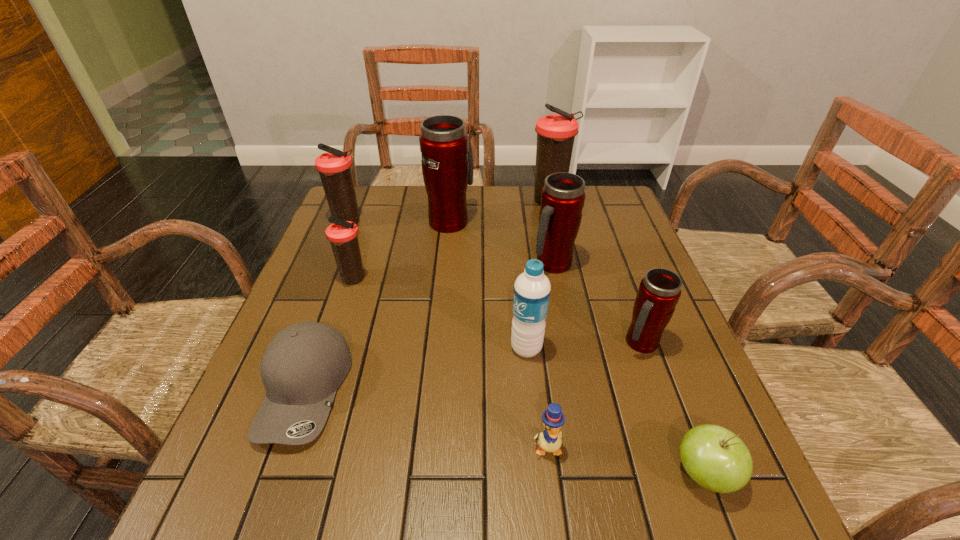
Locate an element on the screen. The height and width of the screenshot is (540, 960). the rightmost brown thermos bottle is located at coordinates click(x=556, y=133).

Where is `the fourth thermos bottle from right to left`? The image size is (960, 540). the fourth thermos bottle from right to left is located at coordinates (447, 163).

At what (x,y) coordinates should I click in order to perform the action: click on the fourth object from left to right. Please return your answer as a coordinate pair (x, y). This screenshot has height=540, width=960. Looking at the image, I should click on (447, 163).

The width and height of the screenshot is (960, 540). I want to click on the second biggest brown thermos bottle, so click(334, 167).

Locate an element on the screen. This screenshot has height=540, width=960. the second biggest red thermos bottle is located at coordinates (562, 199).

Where is `the second nearest red thermos bottle`? the second nearest red thermos bottle is located at coordinates (562, 199).

Image resolution: width=960 pixels, height=540 pixels. I want to click on water bottle, so click(x=532, y=288).

This screenshot has height=540, width=960. What are the coordinates of `the rightmost thermos bottle` in the screenshot? It's located at pyautogui.click(x=659, y=291).

This screenshot has width=960, height=540. I want to click on the nearest thermos bottle, so click(659, 291).

Identify the location of the nearest brown thermos bottle. This screenshot has width=960, height=540. (343, 235).